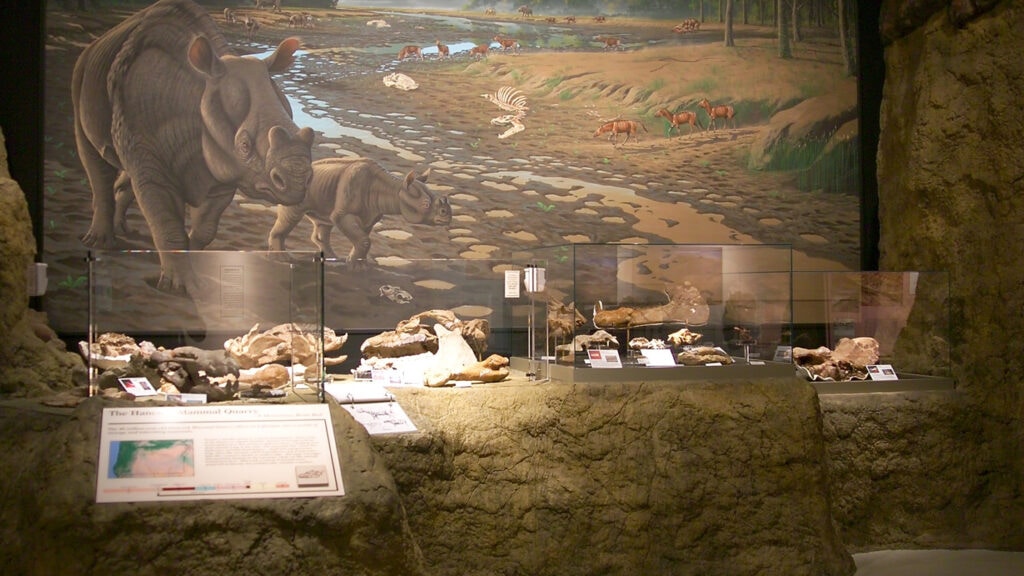
Find the location of a particular element. painting is located at coordinates (764, 153).